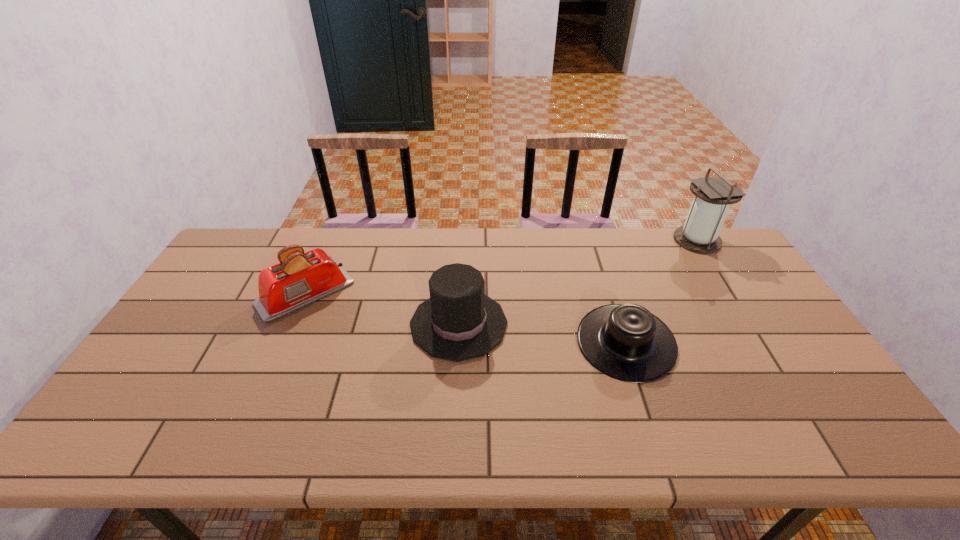
This screenshot has height=540, width=960. Find the location of `vacant area that satisfies the following two spatial constraints: 1. on the front side of the farthest object; 2. on the front of the third object from right to left with the decoration`. vacant area that satisfies the following two spatial constraints: 1. on the front side of the farthest object; 2. on the front of the third object from right to left with the decoration is located at coordinates (750, 324).

What are the coordinates of `blank space that satisfies the following two spatial constraints: 1. on the back side of the shorter dress hat; 2. on the front of the left dress hat with the decoration` in the screenshot? It's located at (619, 324).